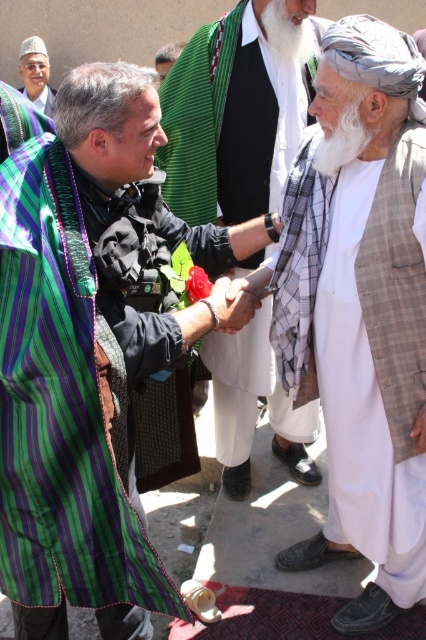
Is white textured robe at center above green striped robe at upper left?

Incorrect, white textured robe at center is not positioned above green striped robe at upper left.

Can you confirm if white textured robe at center is positioned to the right of green striped robe at upper left?

Indeed, white textured robe at center is positioned on the right side of green striped robe at upper left.

Locate an element on the screen. white textured robe at center is located at coordinates (232, 120).

Find the location of `white textured robe at center`. white textured robe at center is located at coordinates (232, 120).

Between whitewoollybeard at center and whitehairbeard at upper center, which one is positioned lower?

Positioned lower is whitewoollybeard at center.

Between point (351, 109) and point (296, 17), which one is positioned behind?

Point (296, 17)

Identify the location of whitewoollybeard at center. Image resolution: width=426 pixels, height=640 pixels. (340, 140).

Between white woolen cap at upper left and green striped robe at upper left, which one appears on the right side from the viewer's perspective?

Positioned to the right is green striped robe at upper left.

Between point (31, 74) and point (48, 102), which one is positioned in front?

Point (31, 74) is in front.

This screenshot has height=640, width=426. Identify the location of white woolen cap at upper left. (36, 74).